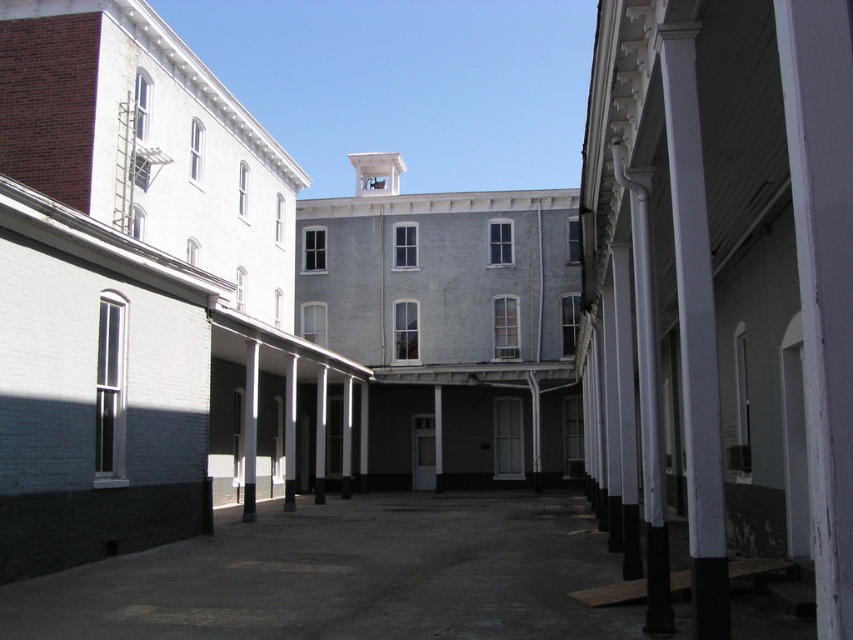
Question: Which point is farther from the camera taking this photo?

Choices:
 (A) pos(218,609)
 (B) pos(715,474)

Answer: (A)

Question: Is dark concrete alley at center behind white painted wood column at right?

Choices:
 (A) yes
 (B) no

Answer: (A)

Question: Is dark concrete alley at center above white painted wood column at right?

Choices:
 (A) no
 (B) yes

Answer: (A)

Question: Which of the following is the farthest from the observer?

Choices:
 (A) dark concrete alley at center
 (B) white painted wood column at right

Answer: (A)

Question: Which object appears farthest from the camera in this image?

Choices:
 (A) dark concrete alley at center
 (B) white painted wood column at right

Answer: (A)

Question: From the image, what is the correct spatial relationship of dark concrete alley at center in relation to white painted wood column at right?

Choices:
 (A) right
 (B) left

Answer: (B)